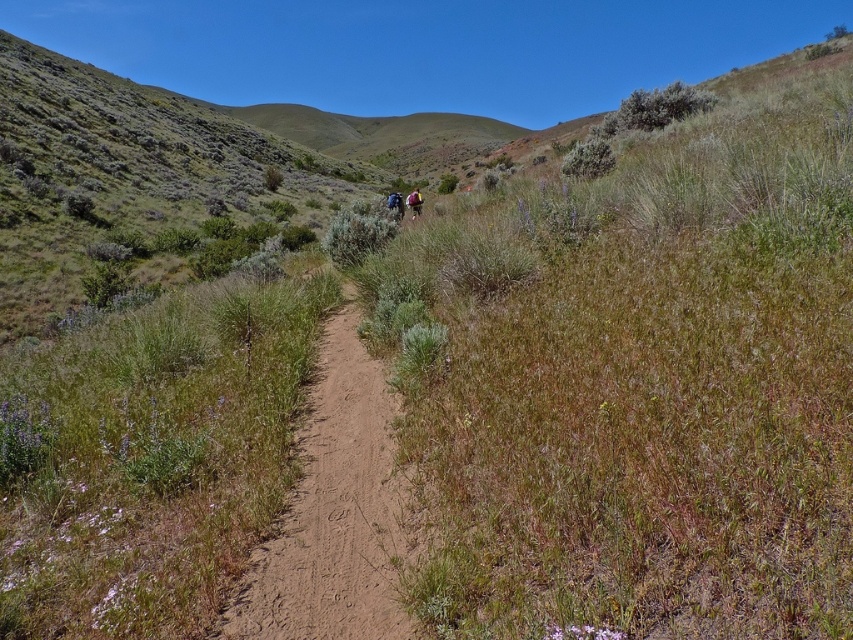
Can you confirm if brown dirt path at center is taller than camouflage backpack at center?

No, brown dirt path at center is not taller than camouflage backpack at center.

Between brown dirt path at center and camouflage backpack at center, which one is positioned lower?

brown dirt path at center is below.

Between point (300, 636) and point (413, 193), which one is positioned in front?

Point (300, 636) is more forward.

What are the coordinates of `brown dirt path at center` in the screenshot? It's located at (334, 509).

Who is positioned more to the right, camouflage backpack at center or dark blue backpack at center?

camouflage backpack at center is more to the right.

Is camouflage backpack at center below dark blue backpack at center?

Actually, camouflage backpack at center is above dark blue backpack at center.

Between point (412, 211) and point (397, 198), which one is positioned in front?

Positioned in front is point (397, 198).

The height and width of the screenshot is (640, 853). Find the location of `camouflage backpack at center`. camouflage backpack at center is located at coordinates (415, 202).

Does brown dirt path at center have a greater width compared to dark blue backpack at center?

In fact, brown dirt path at center might be narrower than dark blue backpack at center.

Can you confirm if brown dirt path at center is positioned to the right of dark blue backpack at center?

Indeed, brown dirt path at center is positioned on the right side of dark blue backpack at center.

Which is in front, point (297, 547) or point (393, 200)?

Point (297, 547) is in front.

The width and height of the screenshot is (853, 640). Identify the location of brown dirt path at center. (334, 509).